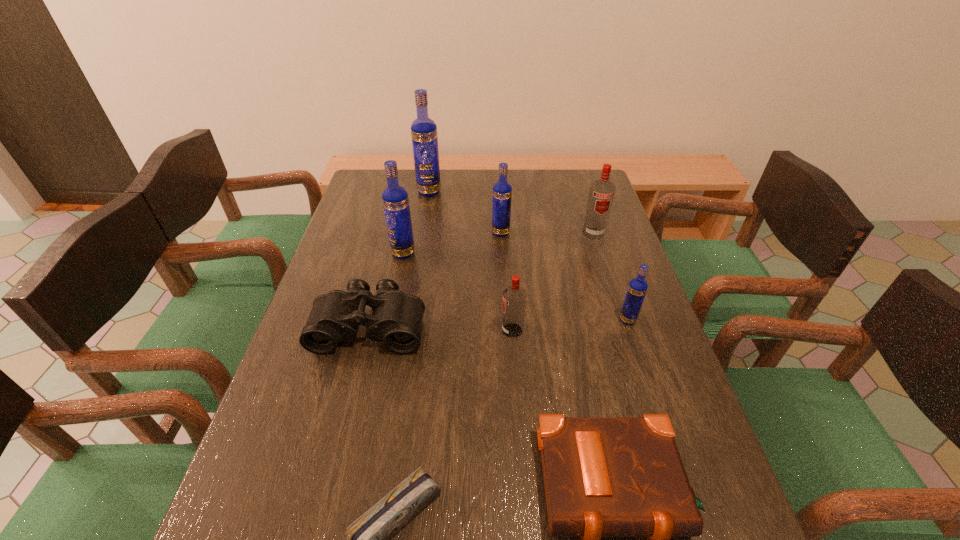
Find the location of a particular element. This screenshot has width=960, height=540. vacant space that satisfies the following two spatial constraints: 1. on the front label of the bigger red vodka; 2. on the front label of the nearer red vodka is located at coordinates (625, 330).